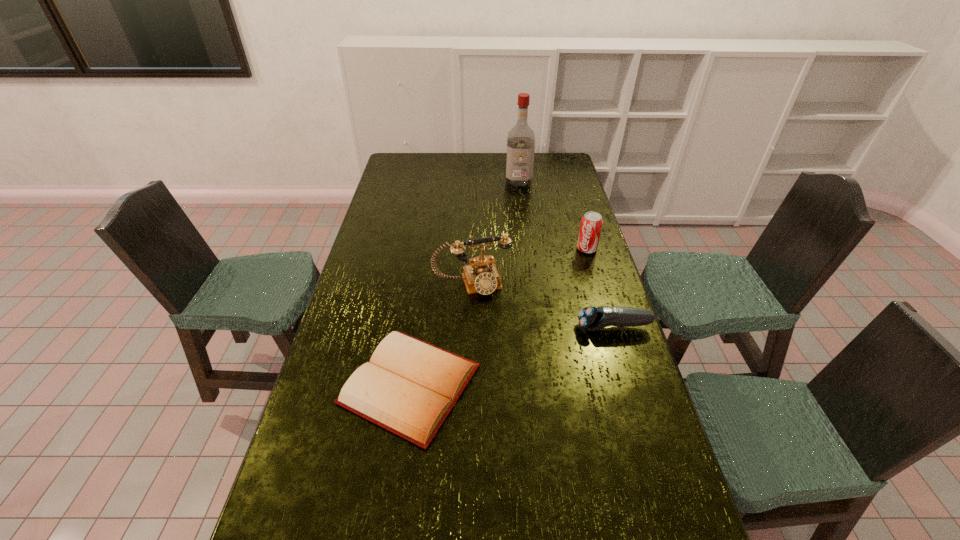
Where is `empty space that is in between the liquor and the telephone`? empty space that is in between the liquor and the telephone is located at coordinates (495, 233).

At what (x,y) coordinates should I click in order to perform the action: click on empty location between the telephone and the second shortest object. Please return your answer as a coordinate pair (x, y). This screenshot has width=960, height=540. Looking at the image, I should click on (543, 306).

Where is `free space that is in between the fourth nearest object and the Bible`? The height and width of the screenshot is (540, 960). free space that is in between the fourth nearest object and the Bible is located at coordinates (498, 317).

Where is `unoccupied position between the second shortest object and the telephone`? This screenshot has width=960, height=540. unoccupied position between the second shortest object and the telephone is located at coordinates (543, 306).

This screenshot has width=960, height=540. I want to click on free space that is in between the second shortest object and the third shortest object, so click(600, 288).

Where is `vacant area that lies between the third farthest object and the fourth tallest object`? Image resolution: width=960 pixels, height=540 pixels. vacant area that lies between the third farthest object and the fourth tallest object is located at coordinates (543, 306).

In order to click on empty location between the telephone and the third shortest object in this screenshot , I will do coord(530,266).

I want to click on vacant space that is in between the third farthest object and the shortest object, so click(441, 334).

The width and height of the screenshot is (960, 540). Find the location of `the fourth closest object to the liquor`. the fourth closest object to the liquor is located at coordinates (409, 387).

This screenshot has height=540, width=960. What are the coordinates of `object that stands as the third closest to the liquor` in the screenshot? It's located at (591, 318).